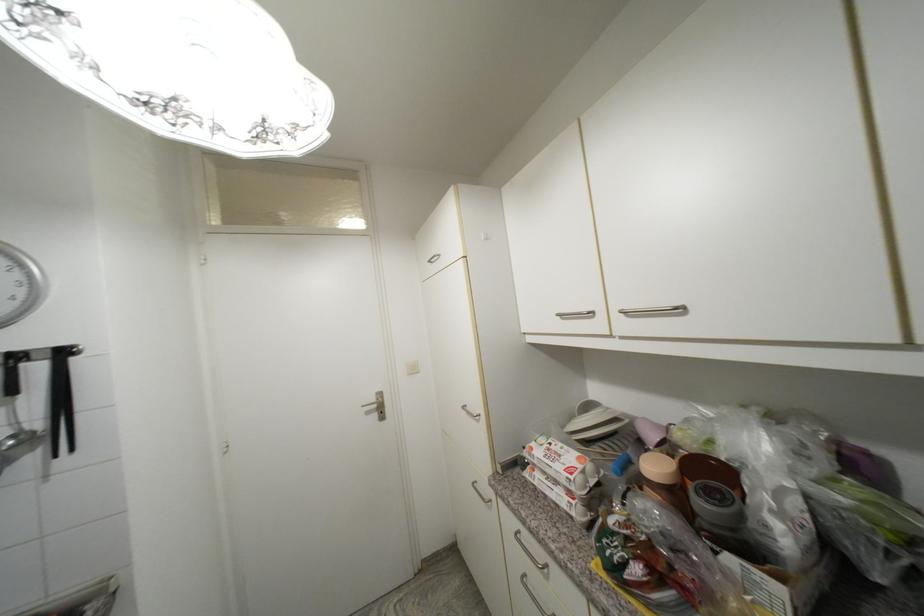
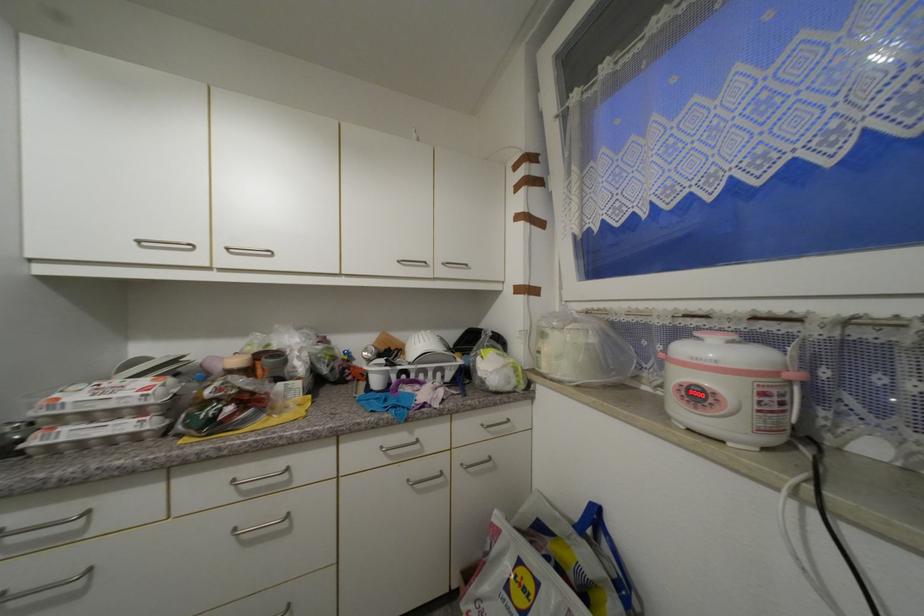
The point at [537,451] is marked in the first image. Where is the corresponding point in the second image?

(64, 400)